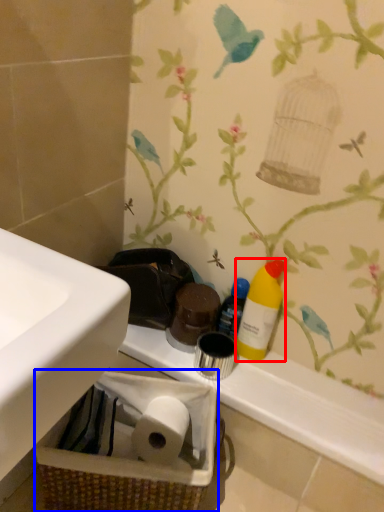
Question: Which of the following is the farthest to the observer, cleaning product (highlighted by a red box) or basket container (highlighted by a blue box)?

Choices:
 (A) cleaning product
 (B) basket container

Answer: (A)